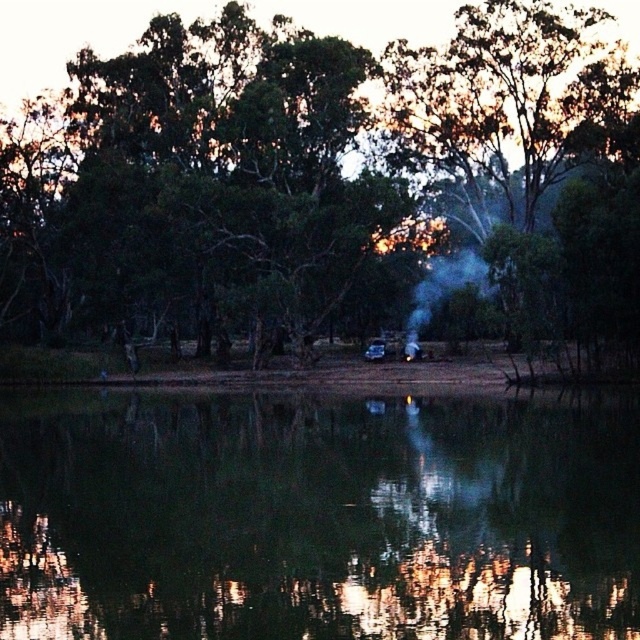
You are standing at the edge of the lake and see the point marked at coordinates (317, 516). Is this point located on the green reflective water at center?

Yes, the point marked at coordinates (317, 516) is on the green reflective water at center according to the description.

You are planning to set up a tent near the green reflective water at center and the green leafy tree at right. Based on their heights, which object should you avoid placing a tall tent next to to prevent blocking the view of the water?

You should avoid placing a tall tent next to the green leafy tree at right because the green reflective water at center is shorter than the green leafy tree at right, so placing a tall tent near the tree would block the view of the water.

You are planning to take a photo of the green leafy tree at right and the white smoke at center from your current position. If you want to include both in the same frame without moving your camera, which object should you focus on first to ensure both are in focus?

To ensure both the green leafy tree at right and the white smoke at center are in focus, you should focus on the white smoke at center first since it is closer to you than the green leafy tree at right, which is 31.86 feet away.